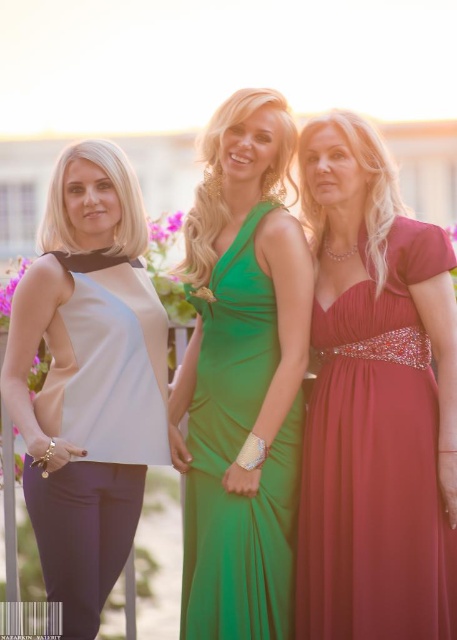
Question: Which object is positioned closest to the green satin dress at center?

Choices:
 (A) shiny burgundy dress at right
 (B) matte white blouse at left

Answer: (A)

Question: Estimate the real-world distances between objects in this image. Which object is farther from the green satin dress at center?

Choices:
 (A) shiny burgundy dress at right
 (B) matte white blouse at left

Answer: (B)

Question: Is matte white blouse at left to the left of green satin dress at center from the viewer's perspective?

Choices:
 (A) yes
 (B) no

Answer: (A)

Question: Can you confirm if shiny burgundy dress at right is positioned above green satin dress at center?

Choices:
 (A) no
 (B) yes

Answer: (A)

Question: Is matte white blouse at left further to the viewer compared to green satin dress at center?

Choices:
 (A) yes
 (B) no

Answer: (A)

Question: Which object appears closest to the camera in this image?

Choices:
 (A) green satin dress at center
 (B) shiny burgundy dress at right
 (C) matte white blouse at left

Answer: (B)